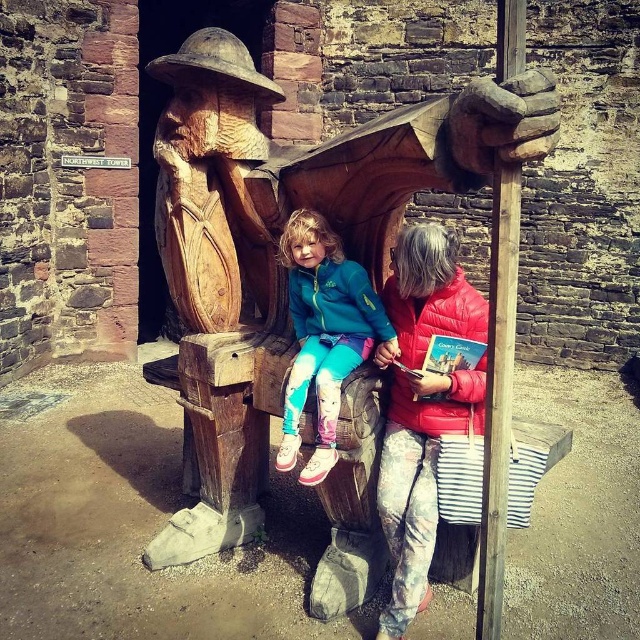
Question: Which point is closer to the camera?

Choices:
 (A) natural wood bench at center
 (B) teal matte jacket at center

Answer: (A)

Question: Can you confirm if natural wood bench at center is thinner than teal matte jacket at center?

Choices:
 (A) no
 (B) yes

Answer: (A)

Question: Considering the relative positions of natural wood bench at center and teal matte jacket at center in the image provided, where is natural wood bench at center located with respect to teal matte jacket at center?

Choices:
 (A) right
 (B) left

Answer: (B)

Question: Which point appears closest to the camera in this image?

Choices:
 (A) (314, 192)
 (B) (360, 349)

Answer: (B)

Question: Where is natural wood bench at center located in relation to teal matte jacket at center in the image?

Choices:
 (A) below
 (B) above

Answer: (B)